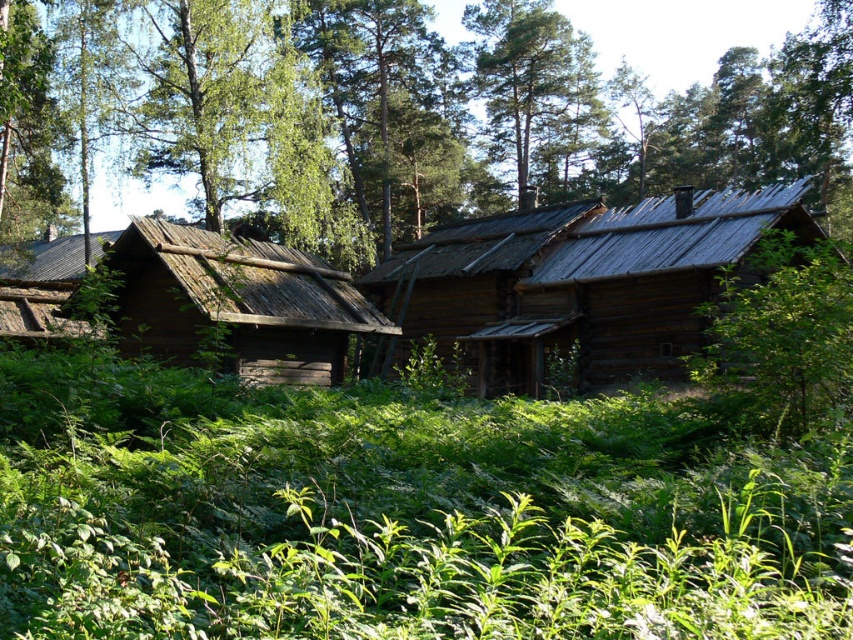
Question: Considering the real-world distances, which object is closest to the wooden log cabin at center?

Choices:
 (A) green leafy tree at upper center
 (B) green leafy grass at center
 (C) brown wooden cabin at center

Answer: (C)

Question: Which point is farther from the camera taking this photo?

Choices:
 (A) coord(653,564)
 (B) coord(523,328)

Answer: (B)

Question: Is green leafy grass at center positioned before wooden log cabin at center?

Choices:
 (A) no
 (B) yes

Answer: (B)

Question: Is green leafy tree at upper center in front of wooden log cabin at center?

Choices:
 (A) no
 (B) yes

Answer: (B)

Question: Among these objects, which one is farthest from the camera?

Choices:
 (A) brown wooden cabin at center
 (B) wooden log cabin at center
 (C) green leafy grass at center

Answer: (B)

Question: Is green leafy tree at upper center further to the viewer compared to brown wooden cabin at center?

Choices:
 (A) no
 (B) yes

Answer: (B)